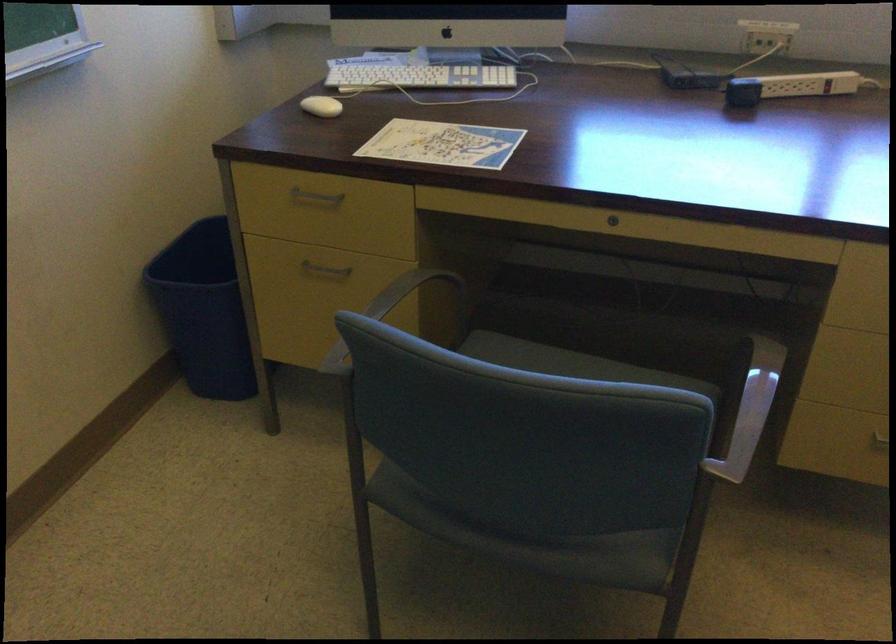
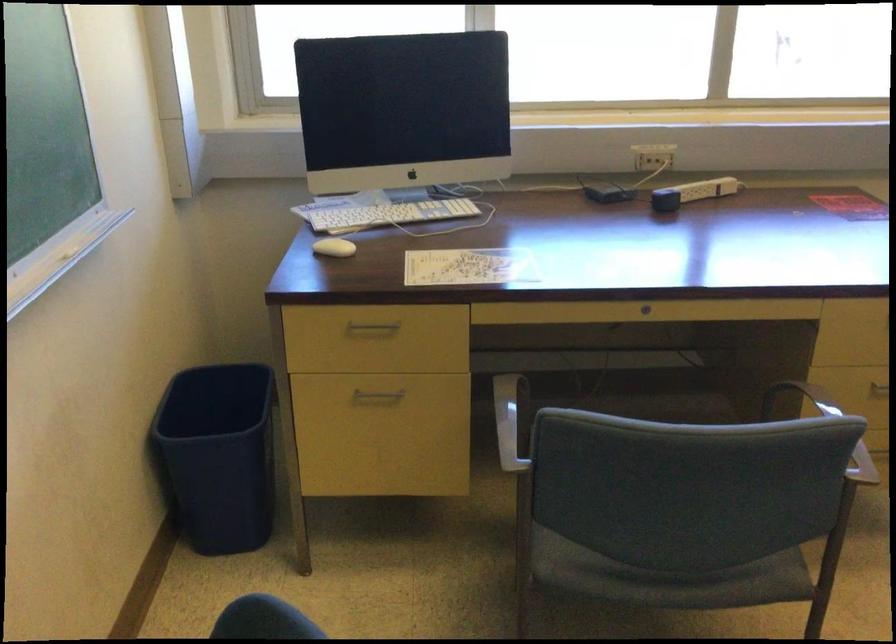
Find the pixel in the second image that matches the point at 612,223 in the first image.

(645, 308)